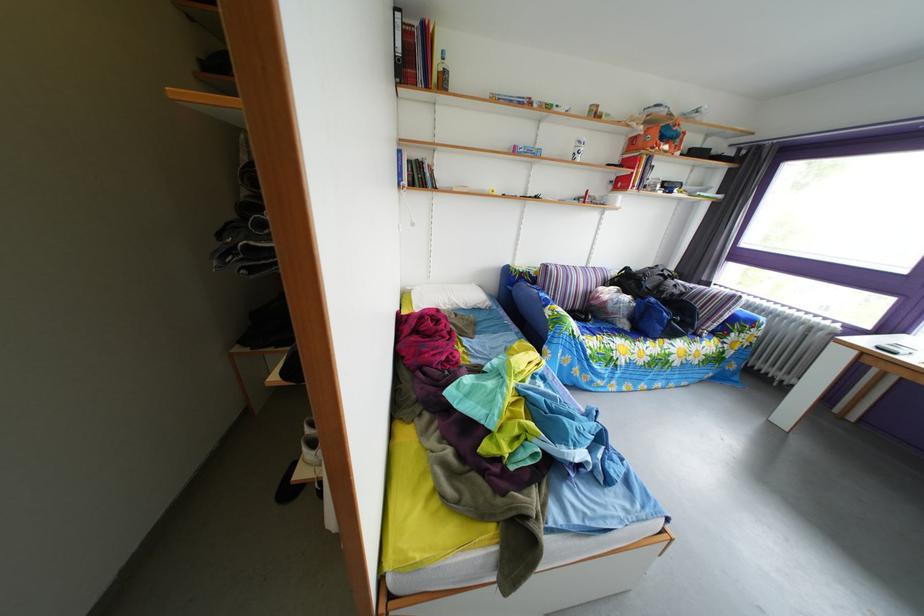
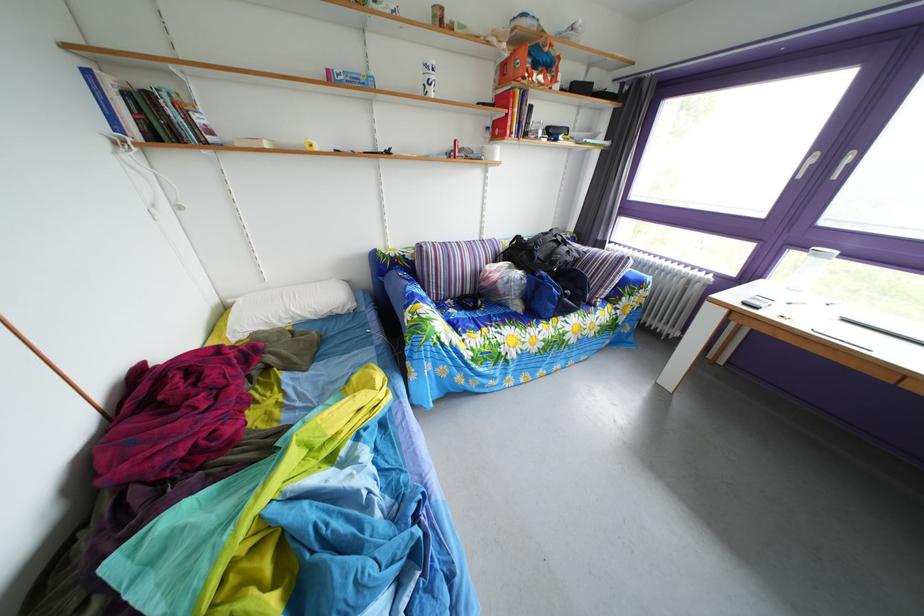
The point at (x=622, y=190) is marked in the first image. Where is the corresponding point in the second image?

(499, 137)